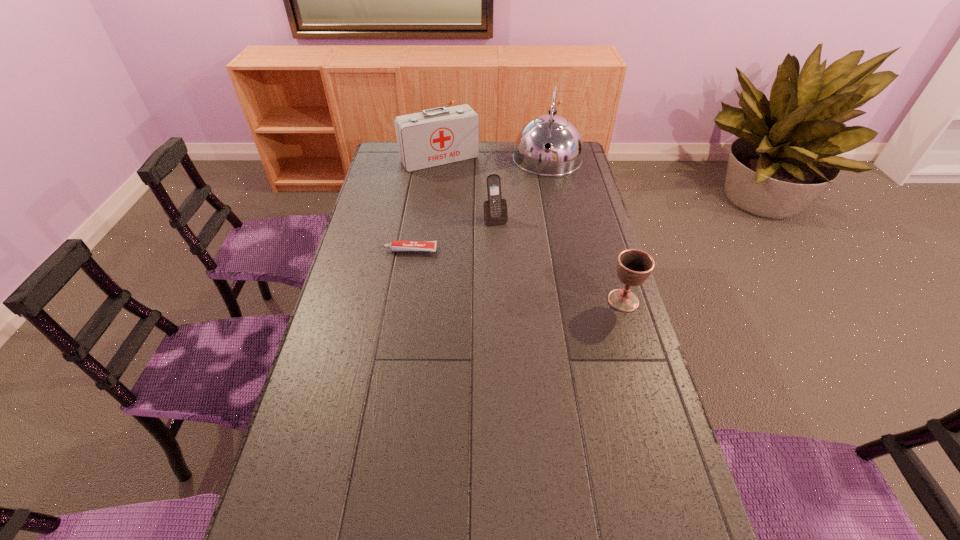
Where is `toothpaste located at the left edge`? The height and width of the screenshot is (540, 960). toothpaste located at the left edge is located at coordinates (396, 246).

Identify the location of the first-aid kit at the left edge. The height and width of the screenshot is (540, 960). (438, 136).

Find the location of `chalice present at the right edge`. chalice present at the right edge is located at coordinates (634, 267).

Where is `kettle located at the right edge`? The height and width of the screenshot is (540, 960). kettle located at the right edge is located at coordinates (564, 155).

Where is `object situated at the far left corner`? Image resolution: width=960 pixels, height=540 pixels. object situated at the far left corner is located at coordinates (438, 136).

Where is `object located in the far right corner section of the desktop`? The height and width of the screenshot is (540, 960). object located in the far right corner section of the desktop is located at coordinates (564, 155).

Locate an element on the screen. The image size is (960, 540). vacant space at the left edge of the desktop is located at coordinates (341, 410).

You are a GUI agent. You are given a task and a screenshot of the screen. Output one action in this format:
    pyautogui.click(x=<x>, y=<y>)
    Task: Click on the vacant area at the right edge
    
    Given the screenshot: What is the action you would take?
    pyautogui.click(x=626, y=435)

Where is `free region at the far right corner of the desktop`? This screenshot has height=540, width=960. free region at the far right corner of the desktop is located at coordinates (581, 168).

Where is `free space at the near right corner of the desktop`? free space at the near right corner of the desktop is located at coordinates [652, 534].